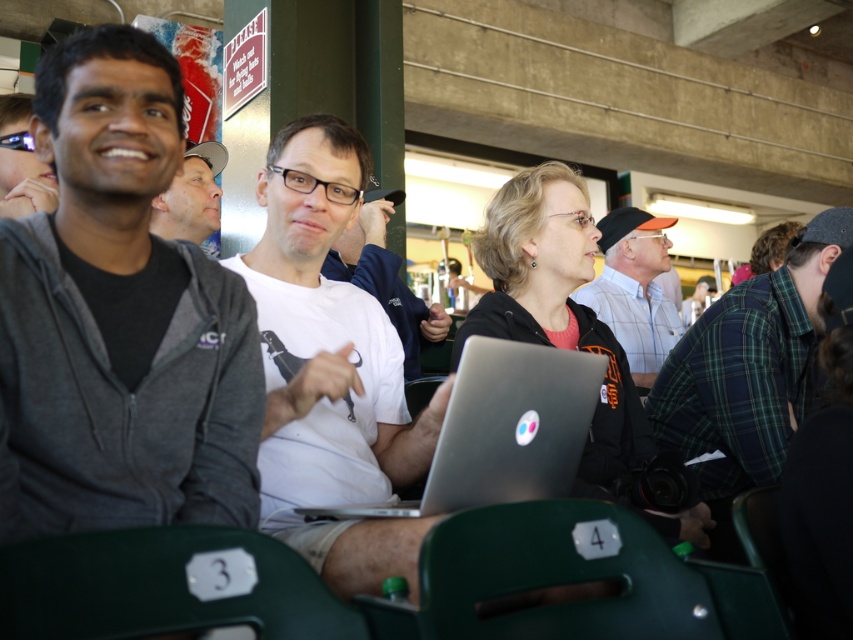
You are organizing a presentation and need to place the silver metallic laptop at center and the matte black glasses at upper left on a shelf. Which object should be placed first to ensure they both fit on the shelf without overlapping?

The silver metallic laptop at center should be placed first because it is shorter than the matte black glasses at upper left, allowing enough space for both to fit without overlapping.

You are organizing a small workshop and need to set up a laptop and glasses for a presenter. Based on the scene, where should you place the silver metallic laptop at center relative to the matte black glasses at upper left?

The silver metallic laptop at center should be placed on the right side of the matte black glasses at upper left, as it is positioned there in the scene.

You are organizing a photo shoot and need to ensure that the green plaid shirt at right and the silver metallic laptop at center are both visible in the frame. Given their sizes, which object should you prioritize positioning closer to the camera to maintain clarity?

The green plaid shirt at right is bigger than the silver metallic laptop at center, so you should prioritize positioning the green plaid shirt at right closer to the camera to maintain clarity.